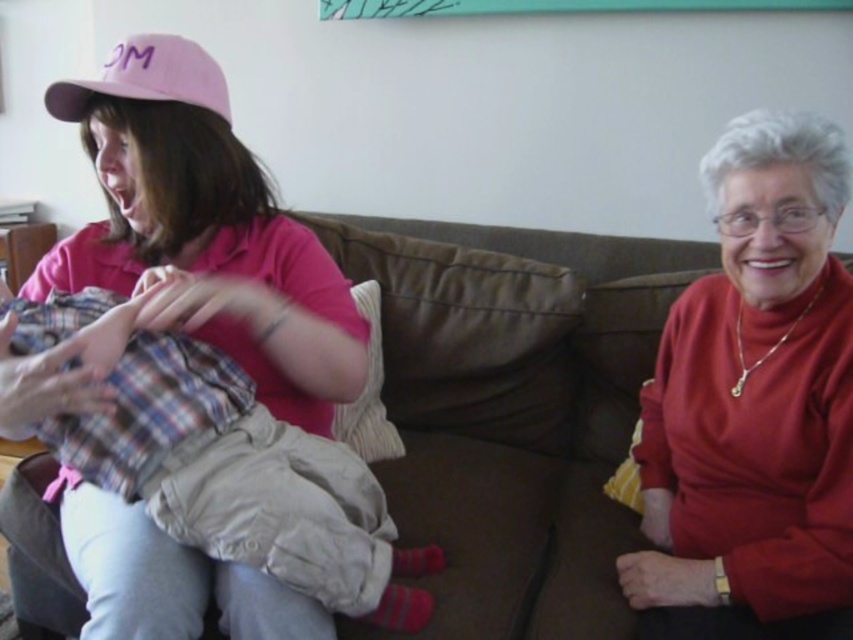
You are a fashion designer analyzing the image. You need to locate the matte red sweater at right for a design project. What are the coordinates where you can find it?

The matte red sweater at right is located at coordinates point (752, 401).